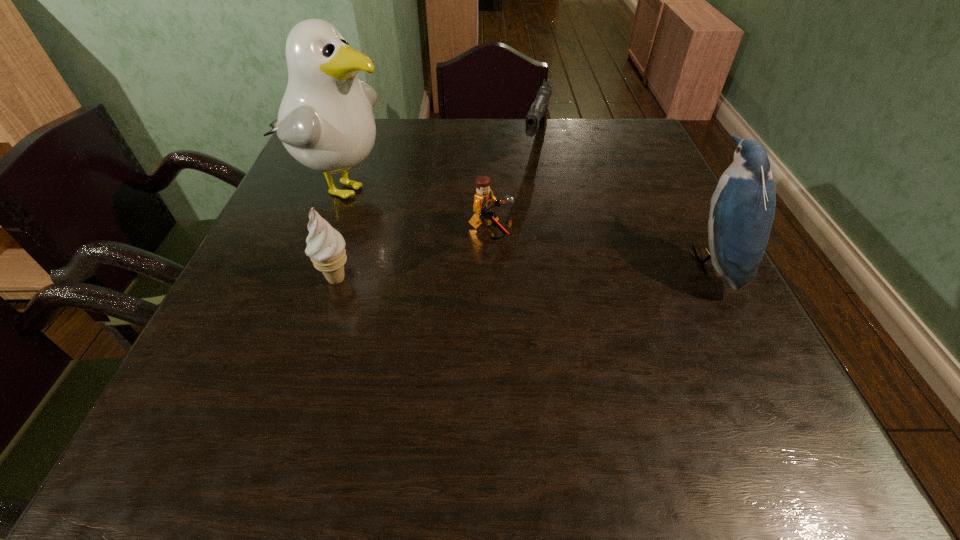
This screenshot has height=540, width=960. In order to click on icecream in this screenshot , I will do `click(325, 246)`.

I want to click on the second tallest object, so click(x=742, y=211).

You are a GUI agent. You are given a task and a screenshot of the screen. Output one action in this format:
    pyautogui.click(x=<x>, y=<y>)
    Task: Click on the rightmost object
    
    Given the screenshot: What is the action you would take?
    pyautogui.click(x=742, y=211)

This screenshot has height=540, width=960. What are the coordinates of `the second object from right to left` in the screenshot? It's located at (536, 120).

You are a GUI agent. You are given a task and a screenshot of the screen. Output one action in this format:
    pyautogui.click(x=<x>, y=<y>)
    Task: Click on the third object from left to right
    This screenshot has height=540, width=960.
    Given the screenshot: What is the action you would take?
    pyautogui.click(x=484, y=199)

In order to click on the tallest object in this screenshot , I will do `click(325, 121)`.

The image size is (960, 540). Find the location of `vacant region located on the front-facing side of the third tallest object`. vacant region located on the front-facing side of the third tallest object is located at coordinates (300, 397).

In order to click on free space located at the tip of the rightmost object's beak in this screenshot , I will do `click(654, 261)`.

At what (x,y) coordinates should I click in order to perform the action: click on blank area located 0.370m at the tip of the rightmost object's beak. Please return your answer as a coordinate pair (x, y). Image resolution: width=960 pixels, height=540 pixels. Looking at the image, I should click on (507, 261).

Identify the location of vacant position located at the tip of the rightmost object's beak. (537, 261).